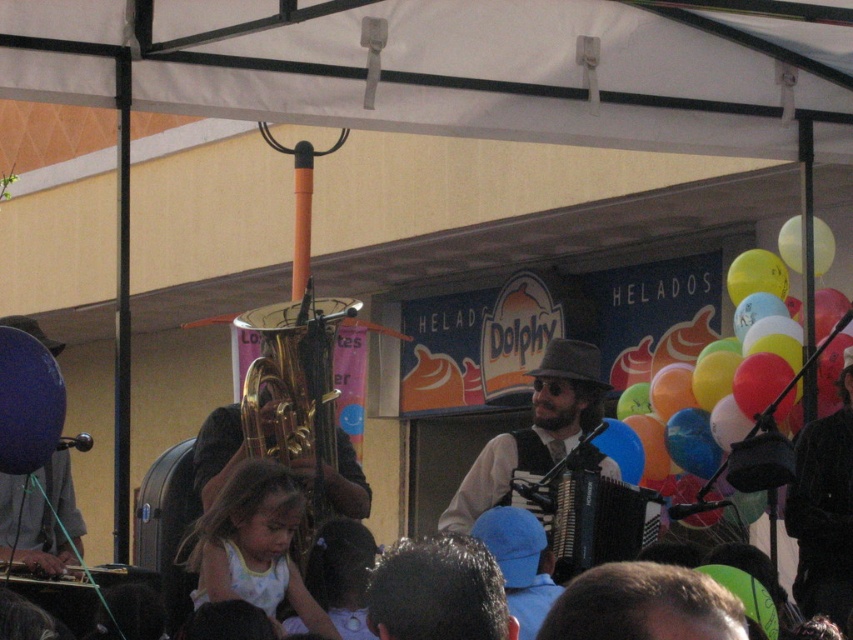
You are a photographer positioned at the center of the stage. You want to take a photo of the gold brass trumpet at center. Where should you aim your camera to capture it?

The gold brass trumpet at center is located at point (296, 396), so you should aim your camera towards those coordinates to capture it.